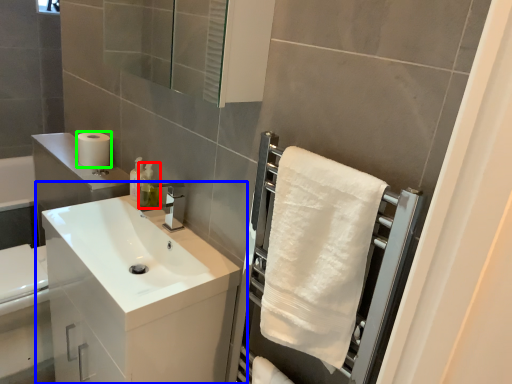
Question: Which object is the closest to the soap dispenser (highlighted by a red box)? Choose among these: bathroom cabinet (highlighted by a blue box) or toilet paper (highlighted by a green box).

Choices:
 (A) bathroom cabinet
 (B) toilet paper

Answer: (B)